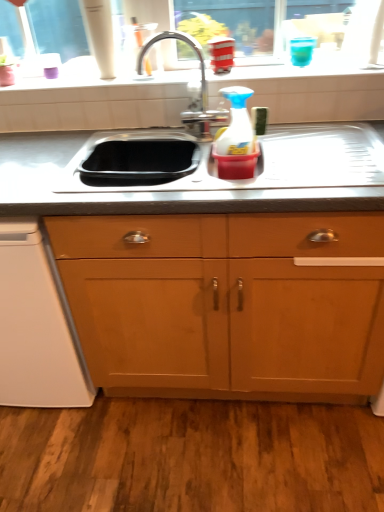
Question: From the image's perspective, is polished chrome faucet at center on white glossy window sill at upper center?

Choices:
 (A) yes
 (B) no

Answer: (B)

Question: Is polished chrome faucet at center wider than white glossy window sill at upper center?

Choices:
 (A) no
 (B) yes

Answer: (A)

Question: From the image's perspective, is polished chrome faucet at center located beneath white glossy window sill at upper center?

Choices:
 (A) yes
 (B) no

Answer: (A)

Question: Are polished chrome faucet at center and white glossy window sill at upper center far apart?

Choices:
 (A) no
 (B) yes

Answer: (A)

Question: Is polished chrome faucet at center smaller than white glossy window sill at upper center?

Choices:
 (A) yes
 (B) no

Answer: (B)

Question: From a real-world perspective, is wooden cabinet at center physically located above or below white plastic dishwasher at lower left?

Choices:
 (A) above
 (B) below

Answer: (A)

Question: Is wooden cabinet at center inside or outside of white plastic dishwasher at lower left?

Choices:
 (A) inside
 (B) outside

Answer: (B)

Question: From the image's perspective, is wooden cabinet at center located above or below white plastic dishwasher at lower left?

Choices:
 (A) below
 (B) above

Answer: (B)

Question: Considering the positions of wooden cabinet at center and white plastic dishwasher at lower left in the image, is wooden cabinet at center taller or shorter than white plastic dishwasher at lower left?

Choices:
 (A) tall
 (B) short

Answer: (A)

Question: Relative to polished chrome faucet at center, is stainless steel sink at center in front or behind?

Choices:
 (A) behind
 (B) front

Answer: (B)

Question: Considering the positions of stainless steel sink at center and polished chrome faucet at center in the image, is stainless steel sink at center taller or shorter than polished chrome faucet at center?

Choices:
 (A) short
 (B) tall

Answer: (A)

Question: From the image's perspective, is stainless steel sink at center located above or below polished chrome faucet at center?

Choices:
 (A) below
 (B) above

Answer: (A)

Question: Considering the positions of stainless steel sink at center and polished chrome faucet at center in the image, is stainless steel sink at center wider or thinner than polished chrome faucet at center?

Choices:
 (A) wide
 (B) thin

Answer: (A)

Question: Would you say polished chrome faucet at center is to the left or to the right of white plastic dishwasher at lower left in the picture?

Choices:
 (A) right
 (B) left

Answer: (A)

Question: From a real-world perspective, is polished chrome faucet at center above or below white plastic dishwasher at lower left?

Choices:
 (A) above
 (B) below

Answer: (A)